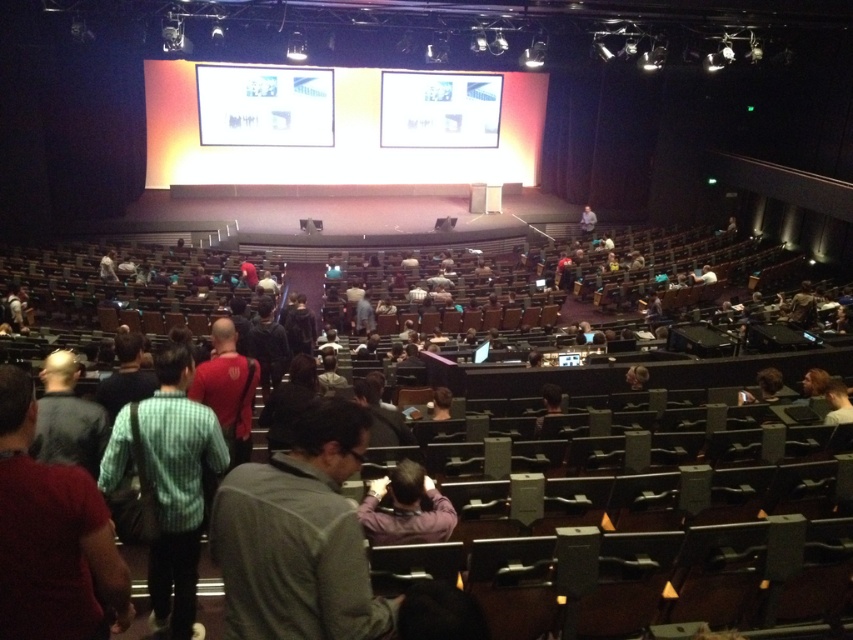
Question: Does green checkered shirt at left have a greater width compared to light gray shirt at upper center?

Choices:
 (A) no
 (B) yes

Answer: (B)

Question: Which object appears closest to the camera in this image?

Choices:
 (A) green checkered shirt at center
 (B) green checkered shirt at left

Answer: (A)

Question: Based on their relative distances, which object is farther from the light gray shirt at upper center?

Choices:
 (A) green checkered shirt at center
 (B) white glossy screen at upper center
 (C) purple matte shirt at center
 (D) green checkered shirt at left

Answer: (A)

Question: Does green checkered shirt at left have a larger size compared to light gray shirt at upper center?

Choices:
 (A) no
 (B) yes

Answer: (B)

Question: Among these objects, which one is farthest from the camera?

Choices:
 (A) purple matte shirt at center
 (B) green checkered shirt at left

Answer: (A)

Question: Is the position of white glossy screen at upper center more distant than that of purple matte shirt at center?

Choices:
 (A) yes
 (B) no

Answer: (A)